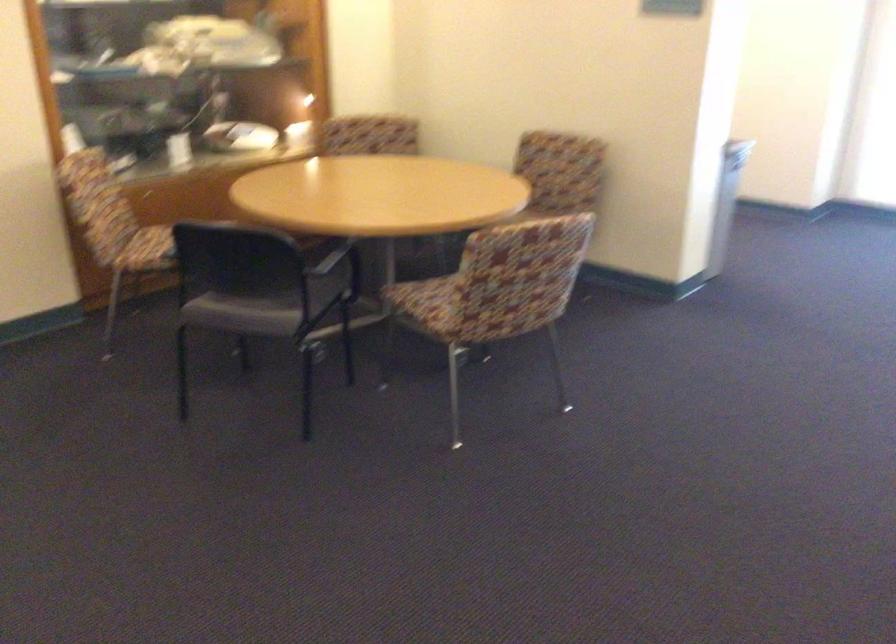
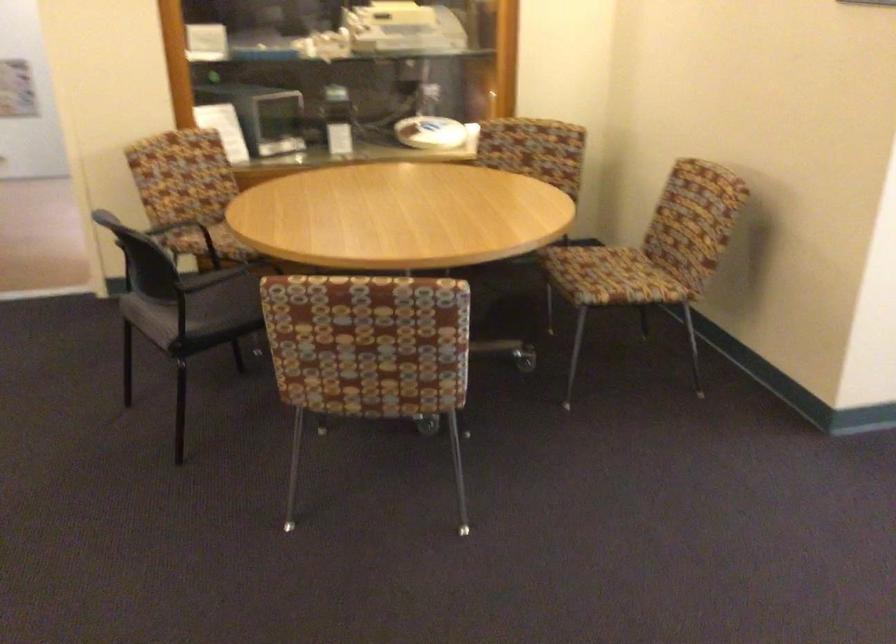
The point at (x=108, y=247) is marked in the first image. Where is the corresponding point in the second image?

(167, 220)